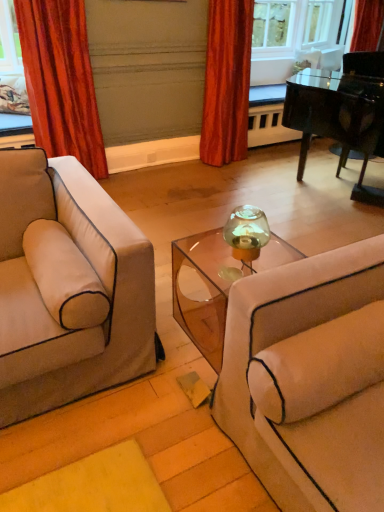
Where is `free location to the right of velvet red curtain at upper center, the second curtain when ordered from left to right`? The width and height of the screenshot is (384, 512). free location to the right of velvet red curtain at upper center, the second curtain when ordered from left to right is located at coordinates (261, 165).